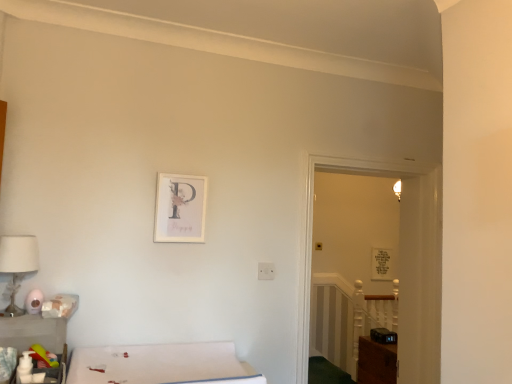
At what (x,y) coordinates should I click in order to perform the action: click on blank space situated above matte plastic toiletries at lower left, marked as the 1th table in a back-to-front arrangement (from a real-world perspective). Please return your answer as a coordinate pair (x, y). Looking at the image, I should click on (30, 308).